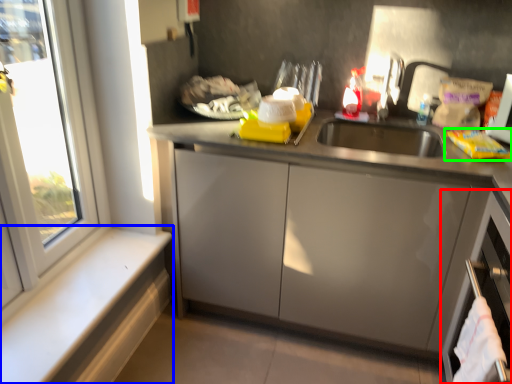
Question: Which object is the farthest from dish washer (highlighted by a red box)? Choose among these: window sill (highlighted by a blue box) or food (highlighted by a green box).

Choices:
 (A) window sill
 (B) food

Answer: (A)